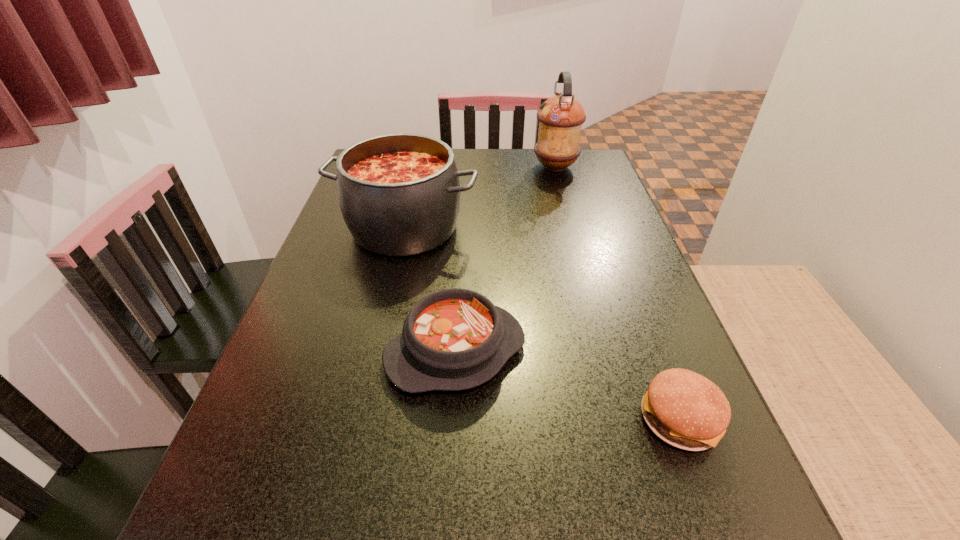
What are the coordinates of `vacant space located 0.350m on the back of the shortest object` in the screenshot? It's located at (619, 261).

This screenshot has height=540, width=960. Identify the location of object that is at the far edge. (560, 118).

At what (x,y) coordinates should I click in order to perform the action: click on object at the left edge. Please return your answer as a coordinate pair (x, y). Image resolution: width=960 pixels, height=540 pixels. Looking at the image, I should click on (399, 194).

Image resolution: width=960 pixels, height=540 pixels. Find the location of `oil lamp that is at the right edge`. oil lamp that is at the right edge is located at coordinates (560, 118).

Locate an element on the screen. The image size is (960, 540). hamburger that is at the right edge is located at coordinates (686, 410).

Identify the location of object that is at the far right corner. (560, 118).

Image resolution: width=960 pixels, height=540 pixels. I want to click on vacant space at the left edge of the desktop, so click(x=357, y=245).

In the image, there is a desktop. Identify the location of vacant space at the right edge. (635, 267).

Find the location of a particular element. free space at the far right corner of the desktop is located at coordinates (575, 168).

Where is `vacant area between the hamburger and the oil lamp`? vacant area between the hamburger and the oil lamp is located at coordinates (617, 293).